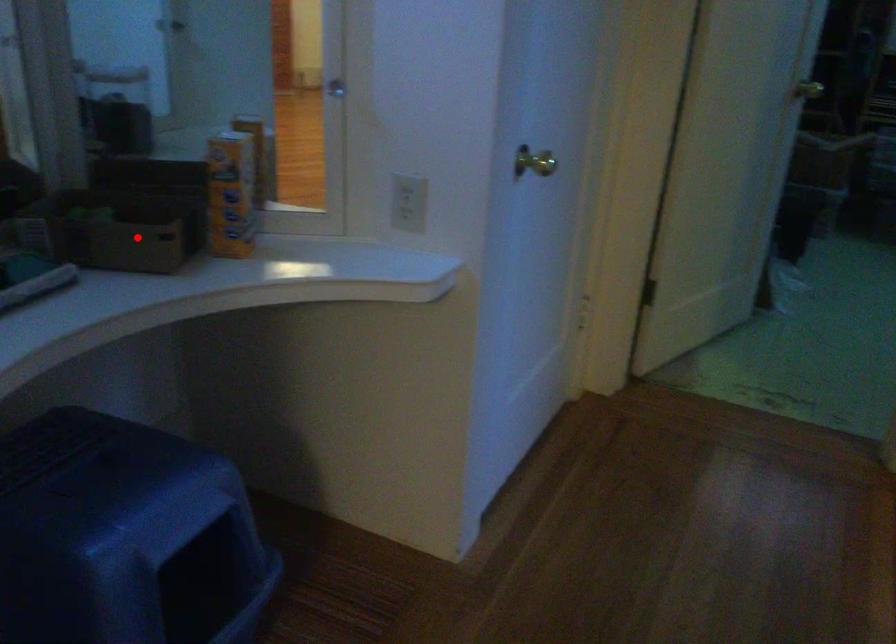
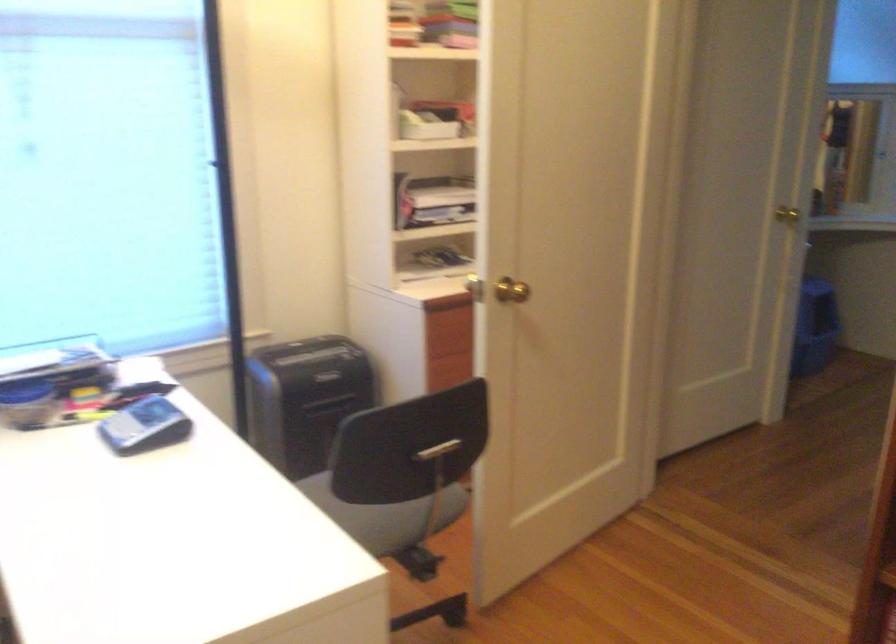
Question: I am providing you with two images of the same scene from different viewpoints. A red point is marked on the first image. Can you still see the location of the red point in image 2?

Choices:
 (A) Yes
 (B) No

Answer: (B)